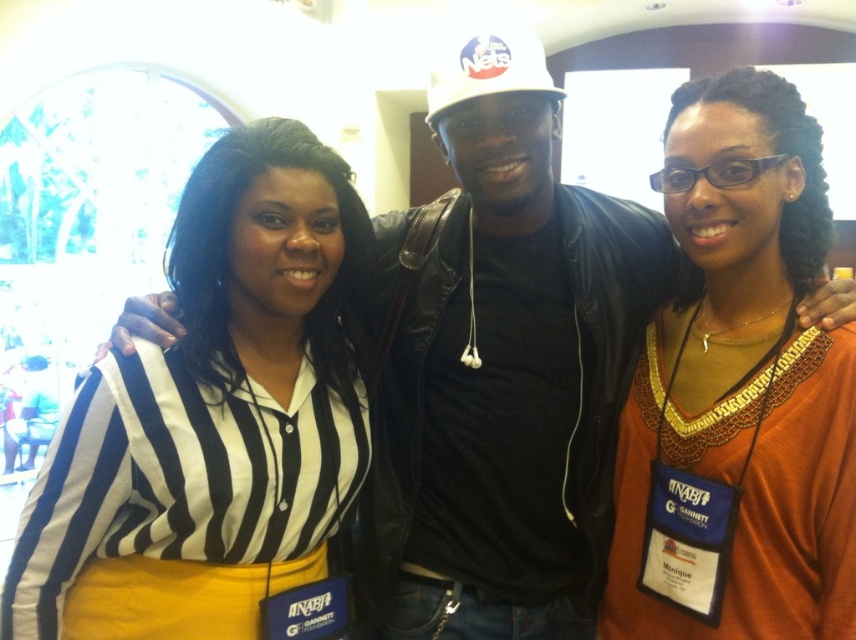
Is orange fabric shirt at center smaller than white matte baseball cap at center?

Actually, orange fabric shirt at center might be larger than white matte baseball cap at center.

Is orange fabric shirt at center shorter than white matte baseball cap at center?

No, orange fabric shirt at center is not shorter than white matte baseball cap at center.

The image size is (856, 640). What are the coordinates of `orange fabric shirt at center` in the screenshot? It's located at (736, 392).

This screenshot has width=856, height=640. Find the location of `orange fabric shirt at center`. orange fabric shirt at center is located at coordinates (736, 392).

Which is below, striped fabric shirt at center or orange fabric shirt at center?

striped fabric shirt at center

Based on the photo, is striped fabric shirt at center wider than orange fabric shirt at center?

Yes.

This screenshot has height=640, width=856. I want to click on striped fabric shirt at center, so click(x=214, y=417).

Where is `striped fabric shirt at center`? striped fabric shirt at center is located at coordinates (214, 417).

Who is more forward, [193,588] or [507,29]?

Positioned in front is point [193,588].

Is the position of striped fabric shirt at center more distant than that of white matte baseball cap at center?

No, striped fabric shirt at center is closer to the viewer.

Locate an element on the screen. This screenshot has height=640, width=856. striped fabric shirt at center is located at coordinates (214, 417).